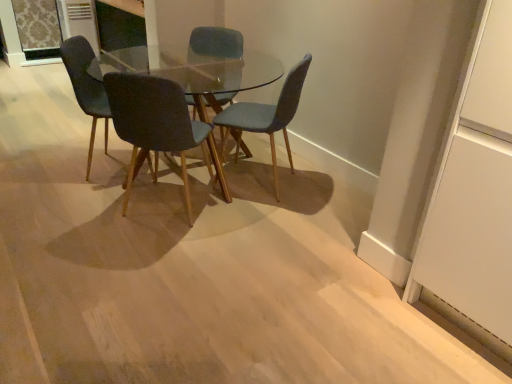
Question: Which direction should I rotate to look at textured blue chair at center, arranged as the 1th chair when viewed from the right, — up or down?

Choices:
 (A) up
 (B) down

Answer: (A)

Question: From a real-world perspective, is transparent glass table at center located beneath textured blue chair at center, arranged as the 1th chair when viewed from the right?

Choices:
 (A) yes
 (B) no

Answer: (A)

Question: Does transparent glass table at center come in front of textured blue chair at center, arranged as the 1th chair when viewed from the right?

Choices:
 (A) no
 (B) yes

Answer: (B)

Question: Considering the relative sizes of transparent glass table at center and textured blue chair at center, arranged as the 1th chair when viewed from the right, in the image provided, is transparent glass table at center bigger than textured blue chair at center, arranged as the 1th chair when viewed from the right,?

Choices:
 (A) yes
 (B) no

Answer: (A)

Question: Considering the relative sizes of transparent glass table at center and textured blue chair at center, acting as the fourth chair starting from the left, in the image provided, is transparent glass table at center wider than textured blue chair at center, acting as the fourth chair starting from the left,?

Choices:
 (A) yes
 (B) no

Answer: (A)

Question: From the image's perspective, is transparent glass table at center on top of textured blue chair at center, acting as the fourth chair starting from the left?

Choices:
 (A) yes
 (B) no

Answer: (A)

Question: From a real-world perspective, is transparent glass table at center located higher than textured blue chair at center, acting as the fourth chair starting from the left?

Choices:
 (A) no
 (B) yes

Answer: (A)

Question: Are matte blue chair at center, which is the first chair in left-to-right order, and dark gray fabric chair at center, which appears as the third chair when viewed from the right, making contact?

Choices:
 (A) yes
 (B) no

Answer: (B)

Question: Does matte blue chair at center, positioned as the fourth chair in right-to-left order, lie behind dark gray fabric chair at center, the 2th chair positioned from the left?

Choices:
 (A) no
 (B) yes

Answer: (B)

Question: Does matte blue chair at center, positioned as the fourth chair in right-to-left order, appear on the right side of dark gray fabric chair at center, which appears as the third chair when viewed from the right?

Choices:
 (A) no
 (B) yes

Answer: (A)

Question: Is dark gray fabric chair at center, which appears as the third chair when viewed from the right, located within matte blue chair at center, positioned as the fourth chair in right-to-left order?

Choices:
 (A) yes
 (B) no

Answer: (B)

Question: Does matte blue chair at center, which is the first chair in left-to-right order, have a smaller size compared to dark gray fabric chair at center, the 2th chair positioned from the left?

Choices:
 (A) no
 (B) yes

Answer: (A)

Question: Does matte blue chair at center, positioned as the fourth chair in right-to-left order, lie in front of dark gray fabric chair at center, the 2th chair positioned from the left?

Choices:
 (A) yes
 (B) no

Answer: (B)

Question: From the image's perspective, is textured blue chair at center, acting as the fourth chair starting from the left, located beneath transparent glass door at upper right?

Choices:
 (A) no
 (B) yes

Answer: (A)